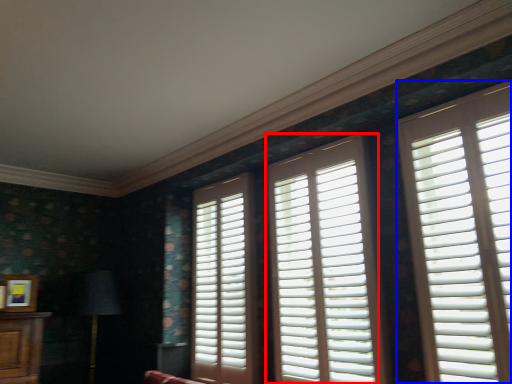
Question: Which object appears farthest to the camera in this image, window (highlighted by a red box) or window (highlighted by a blue box)?

Choices:
 (A) window
 (B) window

Answer: (A)